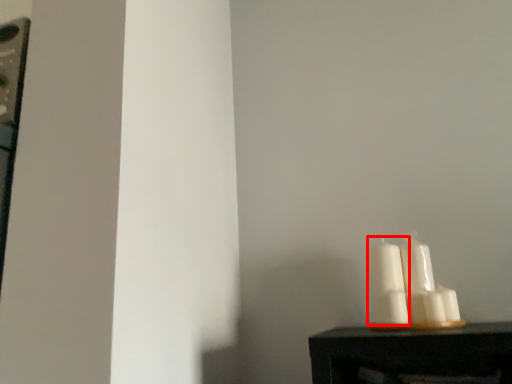
Question: Observing the image, what is the correct spatial positioning of candle (annotated by the red box) in reference to candle?

Choices:
 (A) left
 (B) right

Answer: (A)